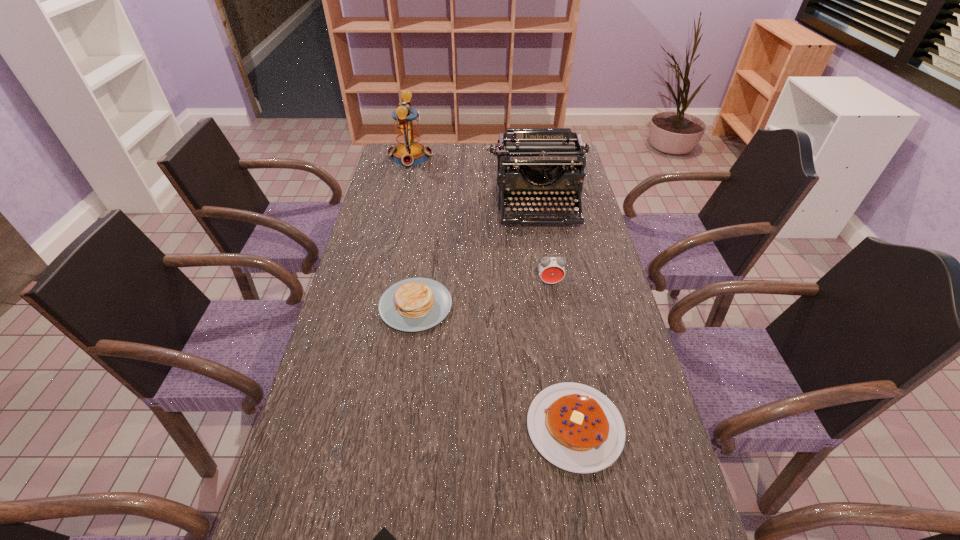
In the image, there is a desktop. Where is `vacant space at the right edge`? The height and width of the screenshot is (540, 960). vacant space at the right edge is located at coordinates (580, 252).

You are a GUI agent. You are given a task and a screenshot of the screen. Output one action in this format:
    pyautogui.click(x=<x>, y=<y>)
    Task: Click on the free space between the second nearest object and the fifth nearest object
    The height and width of the screenshot is (540, 960).
    Given the screenshot: What is the action you would take?
    pyautogui.click(x=556, y=316)

Image resolution: width=960 pixels, height=540 pixels. I want to click on blank region between the farthest object and the alarm clock, so click(x=480, y=220).

This screenshot has width=960, height=540. What are the coordinates of `free space between the nearer pancake and the farthest object` in the screenshot? It's located at (492, 292).

This screenshot has height=540, width=960. I want to click on free space between the third tallest object and the fifth nearest object, so click(543, 244).

At what (x,y) coordinates should I click in order to perform the action: click on empty location between the third tallest object and the second nearest object. Please return your answer as a coordinate pair (x, y). Looking at the image, I should click on (563, 355).

Find the location of a particular element. This screenshot has width=960, height=540. empty space between the lantern and the nearer pancake is located at coordinates (492, 292).

Locate an element on the screen. free area in between the left pancake and the second nearest object is located at coordinates (495, 366).

The height and width of the screenshot is (540, 960). I want to click on free point between the farther pancake and the fourth shortest object, so click(483, 294).

The image size is (960, 540). Find the location of `vacant area that lies between the third tallest object and the second nearest object`. vacant area that lies between the third tallest object and the second nearest object is located at coordinates (563, 355).